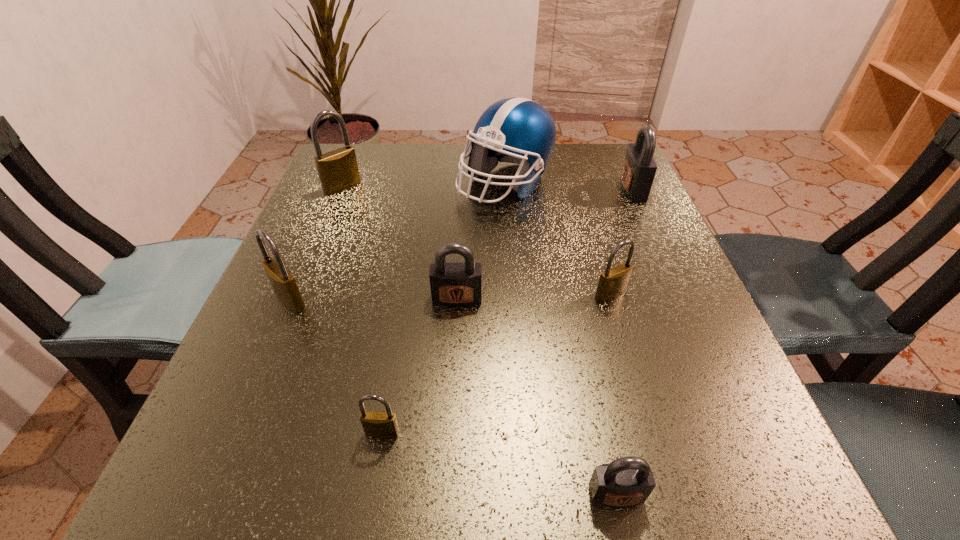
Find the location of a particular element. This screenshot has width=960, height=540. blue football helmet is located at coordinates [516, 130].

What are the coordinates of `the tallest padlock` in the screenshot? It's located at (338, 171).

What are the coordinates of `the biggest brass padlock` in the screenshot? It's located at (338, 171).

Identify the location of the biggest gray padlock. (639, 167).

The width and height of the screenshot is (960, 540). I want to click on the rightmost gray padlock, so click(x=639, y=167).

In order to click on the second biggest brass padlock in this screenshot , I will do `click(283, 282)`.

This screenshot has height=540, width=960. I want to click on the second object from right to left, so click(x=613, y=282).

Locate an element on the screen. the second smallest brass padlock is located at coordinates (613, 282).

At what (x,y) coordinates should I click in order to perform the action: click on the fourth padlock from right to left. Please return your answer as a coordinate pair (x, y). Looking at the image, I should click on (456, 284).

The height and width of the screenshot is (540, 960). Find the location of `the second biggest gray padlock`. the second biggest gray padlock is located at coordinates (456, 284).